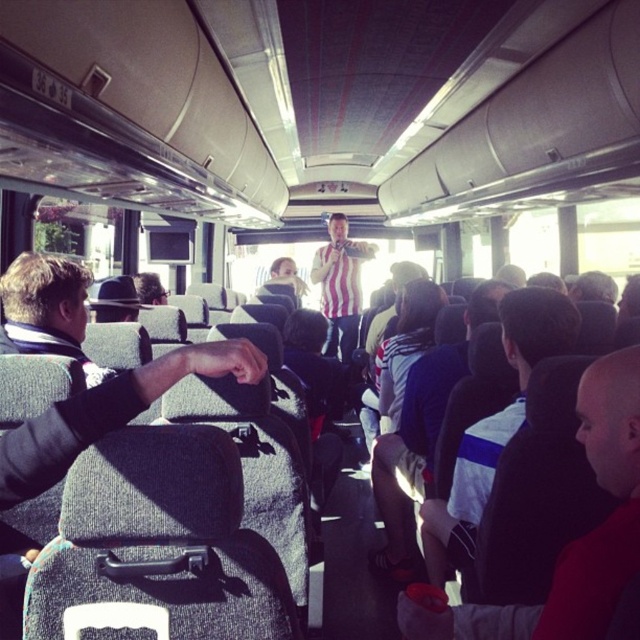
Question: Is dark gray fabric jacket at left closer to the viewer compared to striped shirt at center?

Choices:
 (A) yes
 (B) no

Answer: (A)

Question: In this image, where is dark gray fabric jacket at left located relative to striped shirt at center?

Choices:
 (A) right
 (B) left

Answer: (B)

Question: Considering the relative positions of dark gray fabric jacket at left and striped shirt at center in the image provided, where is dark gray fabric jacket at left located with respect to striped shirt at center?

Choices:
 (A) right
 (B) left

Answer: (B)

Question: Which point is closer to the camera?

Choices:
 (A) striped shirt at center
 (B) dark gray fabric jacket at left

Answer: (B)